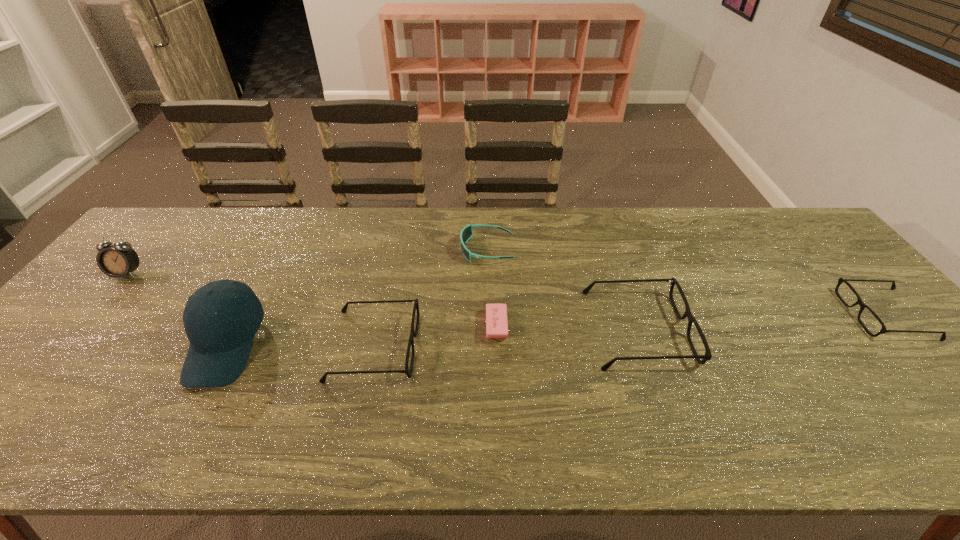
Please point a spot to add another spectacles on the left. Please provide its 2D coordinates. Your answer should be formatted as a tuple, i.e. [(x, y)], where the tuple contains the x and y coordinates of a point satisfying the conditions above.

[(90, 363)]